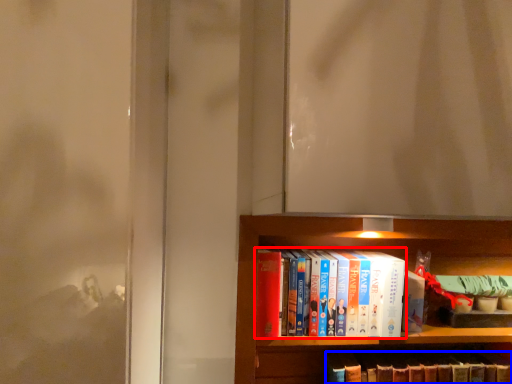
Question: Which of the following is the farthest to the observer, book (highlighted by a red box) or book (highlighted by a blue box)?

Choices:
 (A) book
 (B) book

Answer: (B)